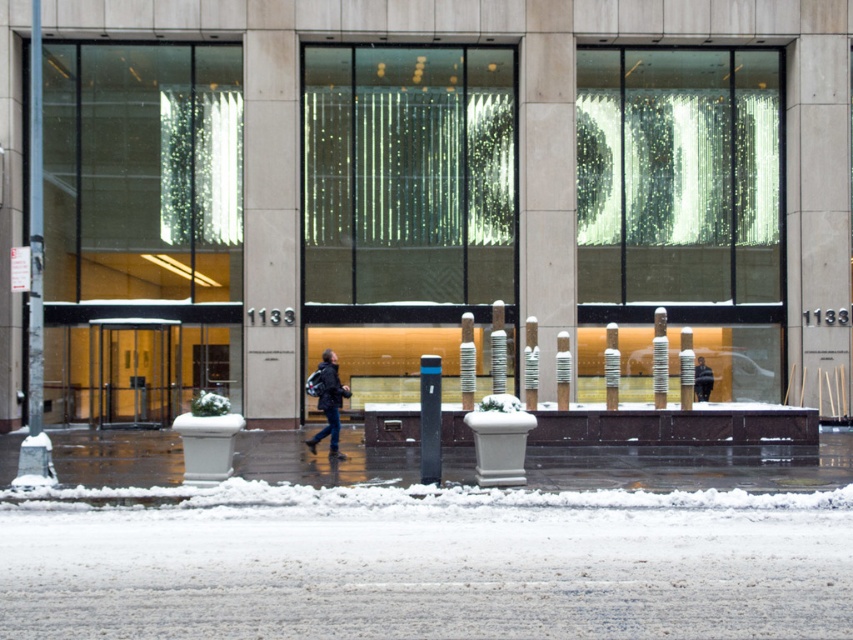
Who is positioned more to the right, white snow at lower center or dark gray jacket at center?

dark gray jacket at center

Does white snow at lower center have a larger size compared to dark gray jacket at center?

Yes.

Is point (473, 524) positioned after point (712, 385)?

That is False.

Where is `white snow at lower center`? The width and height of the screenshot is (853, 640). white snow at lower center is located at coordinates (430, 564).

Is dark blue jeans at center wider than dark gray jacket at center?

No.

Does dark blue jeans at center come behind dark gray jacket at center?

That is False.

Is point (329, 413) in front of point (706, 396)?

Yes.

What are the coordinates of `dark blue jeans at center` in the screenshot? It's located at (329, 401).

Between white snow at lower center and dark blue jeans at center, which one has less height?

With less height is white snow at lower center.

This screenshot has height=640, width=853. I want to click on white snow at lower center, so click(430, 564).

Locate an element on the screen. white snow at lower center is located at coordinates (430, 564).